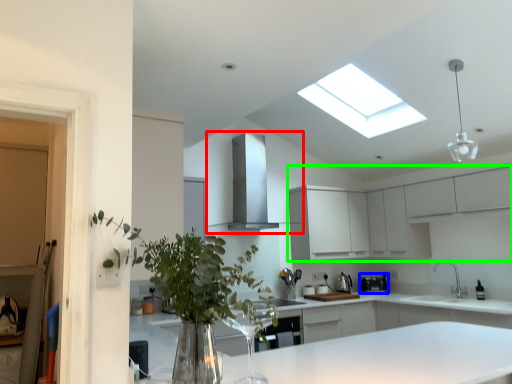
Question: Considering the real-world distances, which object is farthest from exhaust hood (highlighted by a red box)? appliance (highlighted by a blue box) or cabinetry (highlighted by a green box)?

Choices:
 (A) appliance
 (B) cabinetry

Answer: (A)